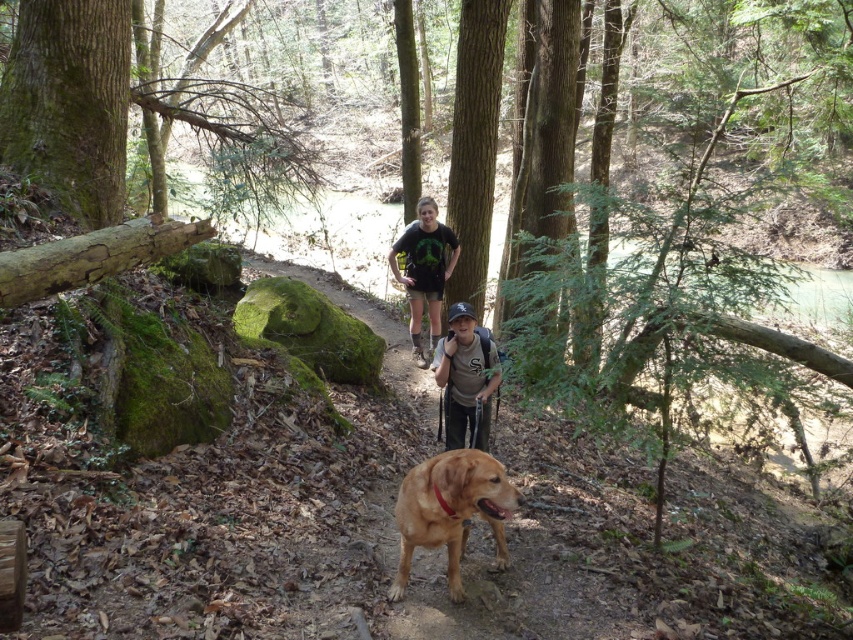
Is golden fur dog at center smaller than khaki cotton shirt at center?

Incorrect, golden fur dog at center is not smaller in size than khaki cotton shirt at center.

Consider the image. Who is more distant from viewer, (498,480) or (444,339)?

The point (444,339) is more distant.

Find the location of a particular element. This screenshot has width=853, height=640. golden fur dog at center is located at coordinates (450, 509).

Is golden fur dog at center to the right of matte black t-shirt at center from the viewer's perspective?

Indeed, golden fur dog at center is positioned on the right side of matte black t-shirt at center.

Is point (518, 499) farther from viewer compared to point (401, 280)?

No, it is in front of (401, 280).

Between point (415, 499) and point (445, 278), which one is positioned behind?

The point (445, 278) is more distant.

This screenshot has width=853, height=640. Identify the location of golden fur dog at center. click(x=450, y=509).

How far apart are khaki cotton shirt at center and matte black t-shirt at center?

The distance of khaki cotton shirt at center from matte black t-shirt at center is 10.09 feet.

In the scene shown: Does khaki cotton shirt at center appear on the left side of matte black t-shirt at center?

In fact, khaki cotton shirt at center is to the right of matte black t-shirt at center.

Is point (440, 385) behind point (426, 211)?

No.

This screenshot has width=853, height=640. In order to click on khaki cotton shirt at center in this screenshot , I will do `click(466, 376)`.